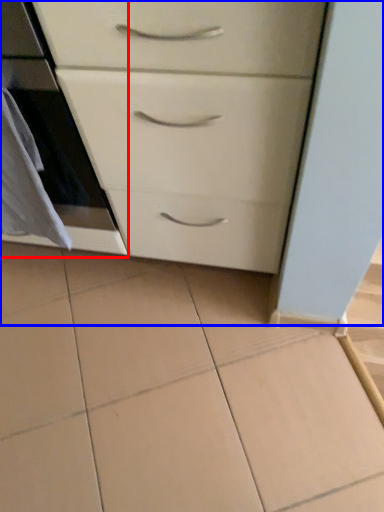
Question: Which object appears closest to the camera in this image, oven (highlighted by a red box) or chest of drawers (highlighted by a blue box)?

Choices:
 (A) oven
 (B) chest of drawers

Answer: (B)